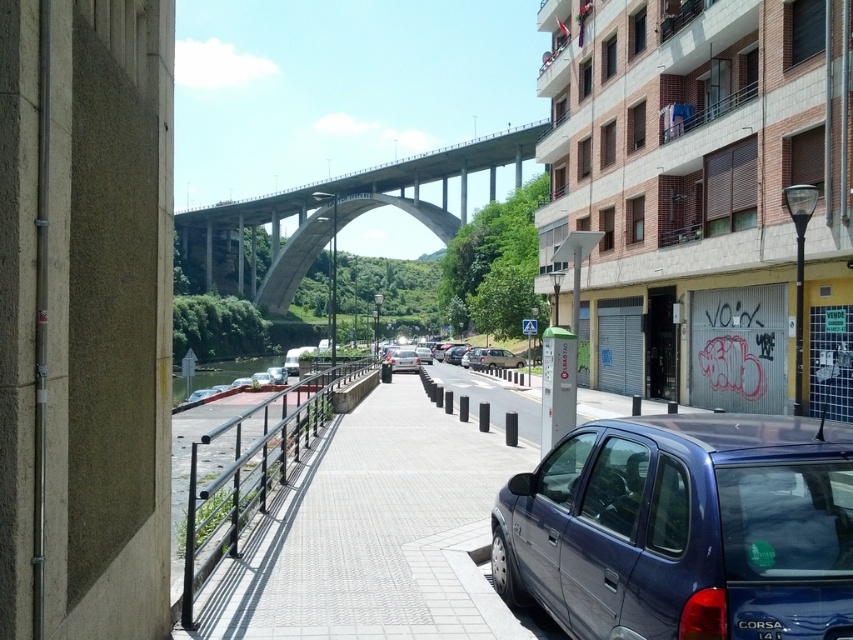
You are standing at the point with coordinates point (408, 353) and want to walk to the point (821, 550). According to the scene, which direction should you move relative to the bridge?

You should move forward towards the bridge because point (821, 550) is in front of point (408, 353).

You are a pedestrian standing on the paved walkway and want to cross the river using the bridge. You see the black metal railing at center and the silver metallic sedan at center. Which object is closer to you as you approach the bridge?

The black metal railing at center is positioned under the silver metallic sedan at center, meaning it is closer to you since it is below the sedan in the scene.

You are standing at the pedestrian pathway and want to take a photo of both the point at coordinate (254,472) and the point at coordinate (397,369). Which point should you focus on first to ensure both are in clear view?

You should focus on point (254,472) first because it is closer to the camera than point (397,369), ensuring both points are in focus.